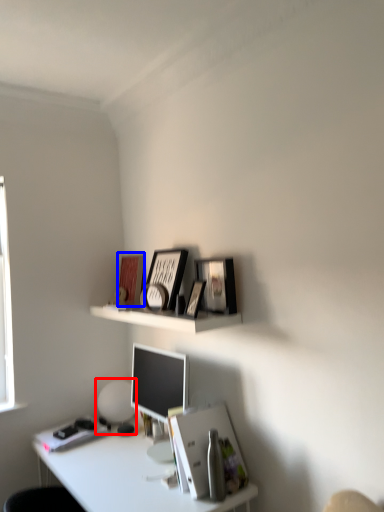
Question: Which point is further to the camera, table lamp (highlighted by a red box) or book cover (highlighted by a blue box)?

Choices:
 (A) table lamp
 (B) book cover

Answer: (B)